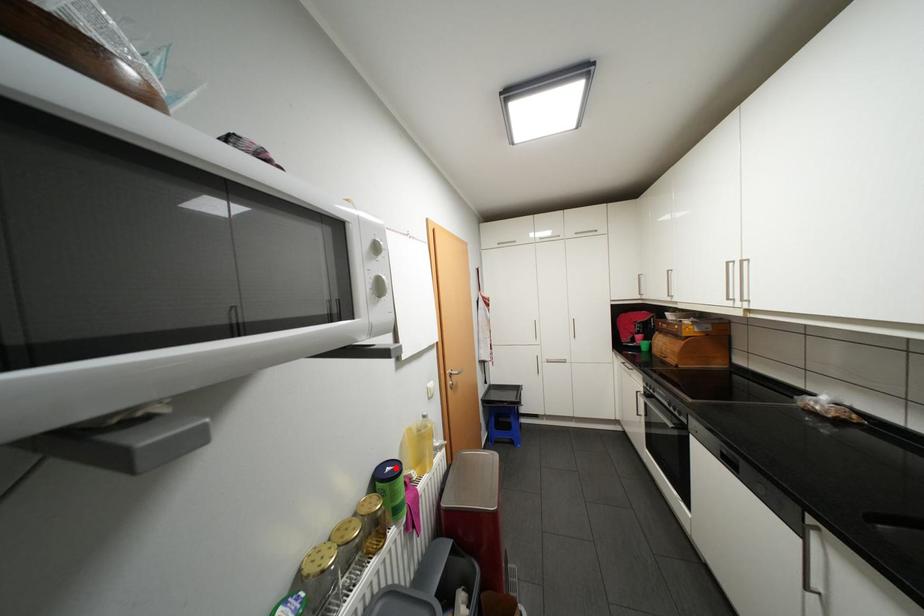
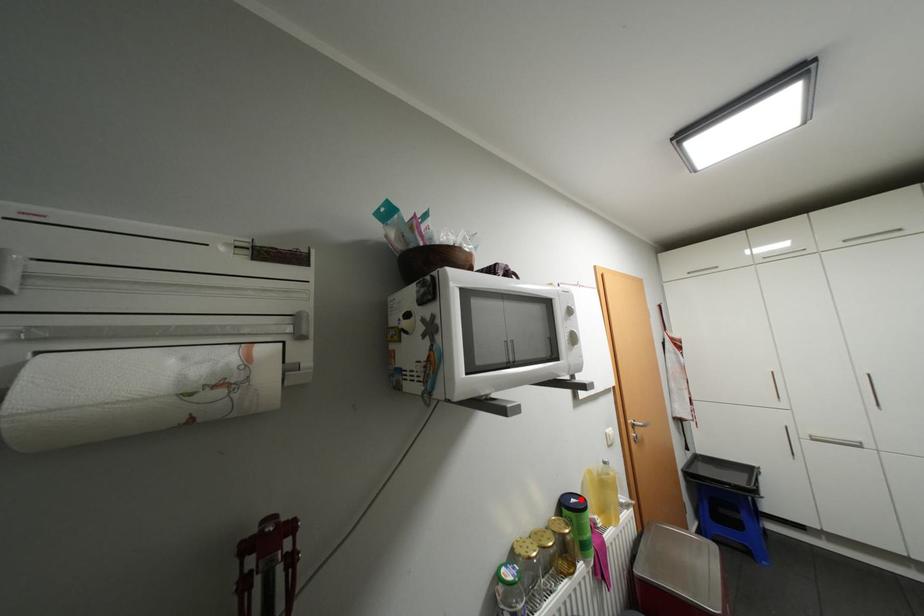
Looking at this image, I am providing you with two images of the same scene from different viewpoints. A red point is marked on the first image and another point is marked on the second image. Is the red point in image1 aligned with the point shown in image2?

Yes